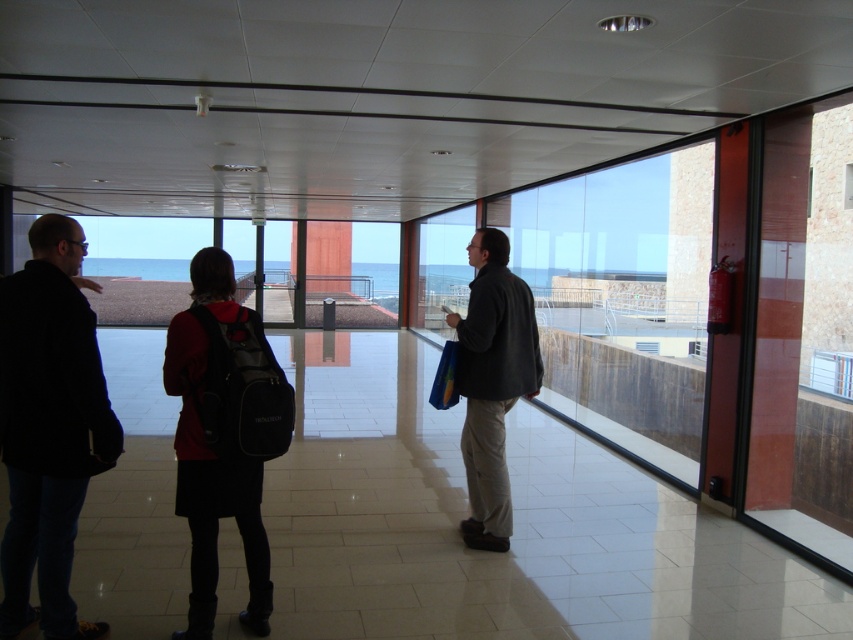
Question: From the image, what is the correct spatial relationship of matte black backpack at center in relation to clear glass window at center?

Choices:
 (A) left
 (B) right

Answer: (A)

Question: Among these objects, which one is nearest to the camera?

Choices:
 (A) matte black backpack at center
 (B) dark gray fabric jacket at center
 (C) dark gray jacket at left
 (D) clear glass window at center

Answer: (C)

Question: Among these points, which one is farthest from the camera?

Choices:
 (A) (828, 349)
 (B) (227, 506)
 (C) (4, 348)

Answer: (A)

Question: Is matte black backpack at center below dark gray fabric jacket at center?

Choices:
 (A) no
 (B) yes

Answer: (B)

Question: Which point is farther to the camera?

Choices:
 (A) dark gray jacket at left
 (B) matte black backpack at center

Answer: (B)

Question: Can you confirm if matte black backpack at center is positioned to the right of clear glass window at center?

Choices:
 (A) no
 (B) yes

Answer: (A)